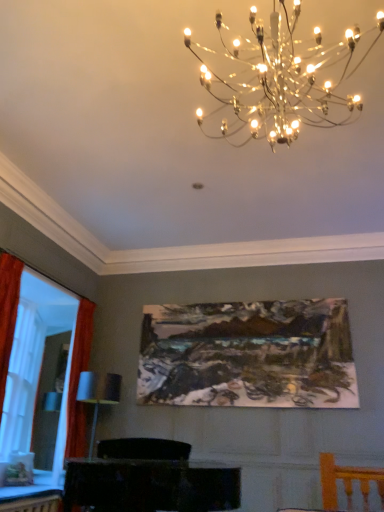
Image resolution: width=384 pixels, height=512 pixels. What do you see at coordinates (248, 355) in the screenshot?
I see `oil painting at center` at bounding box center [248, 355].

Image resolution: width=384 pixels, height=512 pixels. What are the coordinates of `wooden table at lower left` in the screenshot? It's located at tap(32, 495).

Image resolution: width=384 pixels, height=512 pixels. Describe the element at coordinates (280, 78) in the screenshot. I see `metallic chandelier at upper center` at that location.

Where is `oil painting at center`? oil painting at center is located at coordinates (248, 355).

Is matte orange curtain at left at the left side of metallic chandelier at upper center?

Yes, matte orange curtain at left is to the left of metallic chandelier at upper center.

From the picture: From a real-world perspective, between matte orange curtain at left and metallic chandelier at upper center, who is vertically lower?

matte orange curtain at left is physically lower.

Is matte orange curtain at left oriented away from metallic chandelier at upper center?

No, matte orange curtain at left is not facing away from metallic chandelier at upper center.

Does point (237, 504) lie in front of point (14, 498)?

No.

In the scene shown: From a real-world perspective, does matte black cabinet at lower center sit lower than wooden table at lower left?

No, from a real-world perspective, matte black cabinet at lower center is not under wooden table at lower left.

From the image's perspective, is matte black cabinet at lower center beneath wooden table at lower left?

Actually, matte black cabinet at lower center appears above wooden table at lower left in the image.

Considering the relative positions of oil painting at center and metallic chandelier at upper center in the image provided, is oil painting at center in front of metallic chandelier at upper center?

No.

From the image's perspective, is oil painting at center on metallic chandelier at upper center?

Actually, oil painting at center appears below metallic chandelier at upper center in the image.

How different are the orientations of oil painting at center and metallic chandelier at upper center in degrees?

The angle between the facing direction of oil painting at center and the facing direction of metallic chandelier at upper center is 2.17 degrees.

Considering the sizes of objects oil painting at center and metallic chandelier at upper center in the image provided, who is taller, oil painting at center or metallic chandelier at upper center?

oil painting at center.

Who is bigger, oil painting at center or wooden table at lower left?

oil painting at center.

From a real-world perspective, which is physically above, oil painting at center or wooden table at lower left?

From a 3D spatial view, oil painting at center is above.

Is oil painting at center taller than wooden table at lower left?

Yes.

Is oil painting at center positioned with its back to wooden table at lower left?

No, oil painting at center's orientation is not away from wooden table at lower left.

Looking at this image, from the image's perspective, is matte black cabinet at lower center located above or below matte orange curtain at left?

matte black cabinet at lower center is situated lower than matte orange curtain at left in the image.

Could you tell me if matte black cabinet at lower center is facing matte orange curtain at left?

No, matte black cabinet at lower center is not oriented towards matte orange curtain at left.

Does matte black cabinet at lower center have a lesser height compared to matte orange curtain at left?

Yes, matte black cabinet at lower center is shorter than matte orange curtain at left.

From the image's perspective, is matte black cabinet at lower center on top of oil painting at center?

No.

From a real-world perspective, is matte black cabinet at lower center under oil painting at center?

Correct, in the physical world, matte black cabinet at lower center is lower than oil painting at center.

In the scene shown: Is matte black cabinet at lower center in front of or behind oil painting at center in the image?

In the image, matte black cabinet at lower center appears in front of oil painting at center.

Is matte black cabinet at lower center at the back of wooden table at lower left?

No.

Is wooden table at lower left at the right side of matte black cabinet at lower center?

No, wooden table at lower left is not to the right of matte black cabinet at lower center.

Considering the sizes of objects wooden table at lower left and matte black cabinet at lower center in the image provided, who is wider, wooden table at lower left or matte black cabinet at lower center?

matte black cabinet at lower center.

From a real-world perspective, which object rests below the other?

From a 3D spatial view, wooden table at lower left is below.

The width and height of the screenshot is (384, 512). In order to click on lamp that appears above the matte orange curtain at left (from the image's perspective) in this screenshot , I will do coord(280,78).

In the image, there is a matte black cabinet at lower center. Identify the location of table below it (from a real-world perspective). The width and height of the screenshot is (384, 512). (32, 495).

Looking at the image, which one is located further to wooden table at lower left, metallic chandelier at upper center or matte orange curtain at left?

metallic chandelier at upper center is further to wooden table at lower left.

Looking at the image, which one is located further to wooden table at lower left, matte black cabinet at lower center or oil painting at center?

oil painting at center is further to wooden table at lower left.

Estimate the real-world distances between objects in this image. Which object is closer to matte black cabinet at lower center, oil painting at center or metallic chandelier at upper center?

Among the two, oil painting at center is located nearer to matte black cabinet at lower center.

Based on their spatial positions, is metallic chandelier at upper center or matte black cabinet at lower center closer to wooden table at lower left?

Based on the image, matte black cabinet at lower center appears to be nearer to wooden table at lower left.

Considering their positions, is wooden table at lower left positioned closer to matte black cabinet at lower center than metallic chandelier at upper center?

wooden table at lower left is positioned closer to the anchor matte black cabinet at lower center.

Estimate the real-world distances between objects in this image. Which object is further from wooden table at lower left, matte orange curtain at left or oil painting at center?

The object further to wooden table at lower left is oil painting at center.

From the image, which object appears to be farther from matte orange curtain at left, wooden table at lower left or matte black cabinet at lower center?

Based on the image, matte black cabinet at lower center appears to be further to matte orange curtain at left.

Which object lies nearer to the anchor point wooden table at lower left, metallic chandelier at upper center or oil painting at center?

Among the two, oil painting at center is located nearer to wooden table at lower left.

Identify the location of table between matte orange curtain at left and matte black cabinet at lower center. The width and height of the screenshot is (384, 512). (32, 495).

Find the location of a particular element. furniture between metallic chandelier at upper center and wooden table at lower left from top to bottom is located at coordinates (149, 486).

At what (x,y) coordinates should I click in order to perform the action: click on bay window that lies between metallic chandelier at upper center and matte black cabinet at lower center from top to bottom. Please return your answer as a coordinate pair (x, y). This screenshot has width=384, height=512. Looking at the image, I should click on (78, 378).

Locate an element on the screen. This screenshot has width=384, height=512. furniture located between matte orange curtain at left and oil painting at center in the left-right direction is located at coordinates (149, 486).